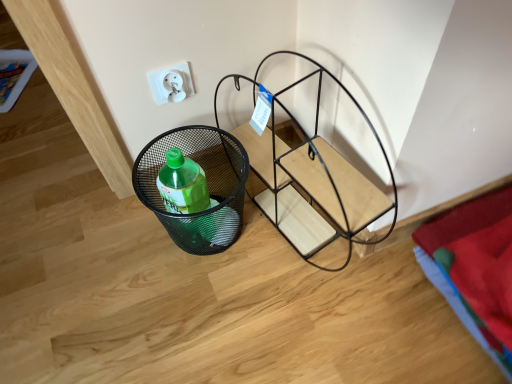
Question: From the image's perspective, is white plastic electric outlet at upper center located above black metal wire basket at lower left?

Choices:
 (A) yes
 (B) no

Answer: (A)

Question: Is white plastic electric outlet at upper center far away from black metal wire basket at lower left?

Choices:
 (A) yes
 (B) no

Answer: (B)

Question: Considering the relative sizes of white plastic electric outlet at upper center and black metal wire basket at lower left in the image provided, is white plastic electric outlet at upper center thinner than black metal wire basket at lower left?

Choices:
 (A) yes
 (B) no

Answer: (A)

Question: Is the depth of white plastic electric outlet at upper center less than that of black metal wire basket at lower left?

Choices:
 (A) no
 (B) yes

Answer: (A)

Question: Is black metal wire basket at lower left surrounded by white plastic electric outlet at upper center?

Choices:
 (A) yes
 (B) no

Answer: (B)

Question: Based on their positions, is black mesh basket at lower left located to the left or right of white plastic electric outlet at upper center?

Choices:
 (A) left
 (B) right

Answer: (B)

Question: Considering the positions of black mesh basket at lower left and white plastic electric outlet at upper center in the image, is black mesh basket at lower left bigger or smaller than white plastic electric outlet at upper center?

Choices:
 (A) small
 (B) big

Answer: (B)

Question: Is point (136, 193) positioned closer to the camera than point (187, 72)?

Choices:
 (A) farther
 (B) closer

Answer: (A)

Question: In terms of height, does black mesh basket at lower left look taller or shorter compared to white plastic electric outlet at upper center?

Choices:
 (A) tall
 (B) short

Answer: (A)

Question: Would you say black metal wire basket at lower left is inside or outside black mesh basket at lower left?

Choices:
 (A) inside
 (B) outside

Answer: (B)

Question: Is black metal wire basket at lower left to the left or to the right of black mesh basket at lower left in the image?

Choices:
 (A) left
 (B) right

Answer: (B)

Question: Considering the positions of black metal wire basket at lower left and black mesh basket at lower left in the image, is black metal wire basket at lower left bigger or smaller than black mesh basket at lower left?

Choices:
 (A) big
 (B) small

Answer: (A)

Question: Is black metal wire basket at lower left in front of or behind black mesh basket at lower left in the image?

Choices:
 (A) behind
 (B) front

Answer: (B)

Question: From a real-world perspective, relative to white plastic electric outlet at upper center, is black metal wire basket at lower left vertically above or below?

Choices:
 (A) above
 (B) below

Answer: (B)

Question: In terms of height, does black metal wire basket at lower left look taller or shorter compared to white plastic electric outlet at upper center?

Choices:
 (A) short
 (B) tall

Answer: (B)